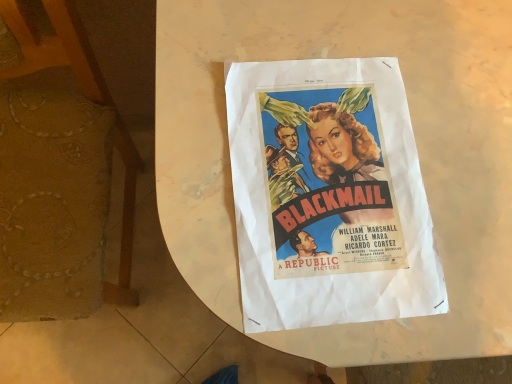
Identify the location of free spot below matte paper poster at center (from a real-world perspective). pyautogui.click(x=327, y=186).